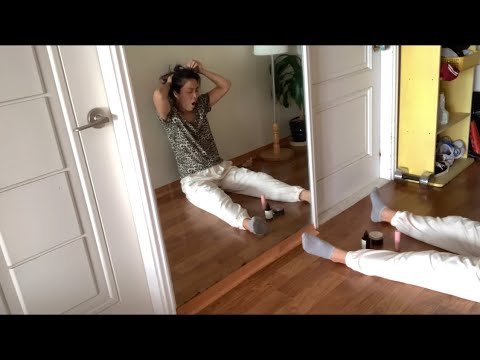
Locate an element on the screen. lamp is located at coordinates (277, 49).